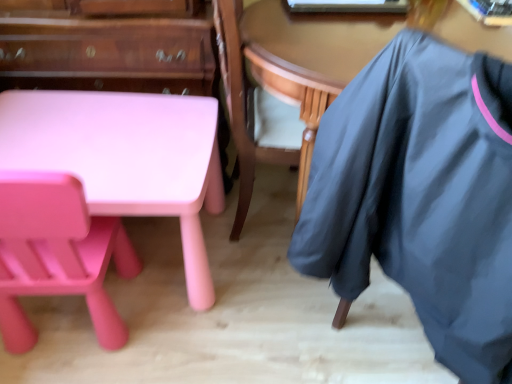
Question: Is wooden table at center aimed at matte pink table at lower left?

Choices:
 (A) no
 (B) yes

Answer: (A)

Question: Are wooden table at center and matte pink table at lower left located far from each other?

Choices:
 (A) yes
 (B) no

Answer: (B)

Question: Considering the relative sizes of wooden table at center and matte pink table at lower left in the image provided, is wooden table at center thinner than matte pink table at lower left?

Choices:
 (A) yes
 (B) no

Answer: (B)

Question: Does wooden table at center have a greater width compared to matte pink table at lower left?

Choices:
 (A) no
 (B) yes

Answer: (B)

Question: Is wooden table at center to the right of matte pink table at lower left from the viewer's perspective?

Choices:
 (A) no
 (B) yes

Answer: (B)

Question: Is wooden table at center positioned in front of matte pink table at lower left?

Choices:
 (A) no
 (B) yes

Answer: (B)

Question: Is matte pink chair at lower left taller than matte pink plastic desk at lower left?

Choices:
 (A) no
 (B) yes

Answer: (B)

Question: Is matte pink chair at lower left further to camera compared to matte pink plastic desk at lower left?

Choices:
 (A) no
 (B) yes

Answer: (A)

Question: Is matte pink chair at lower left smaller than matte pink plastic desk at lower left?

Choices:
 (A) yes
 (B) no

Answer: (A)

Question: Does matte pink chair at lower left have a larger size compared to matte pink plastic desk at lower left?

Choices:
 (A) no
 (B) yes

Answer: (A)

Question: Can you confirm if matte pink chair at lower left is positioned to the right of matte pink plastic desk at lower left?

Choices:
 (A) yes
 (B) no

Answer: (B)

Question: Is matte pink chair at lower left facing away from matte pink plastic desk at lower left?

Choices:
 (A) no
 (B) yes

Answer: (B)

Question: Does wooden table at center have a greater height compared to dark gray fabric at right?

Choices:
 (A) yes
 (B) no

Answer: (B)